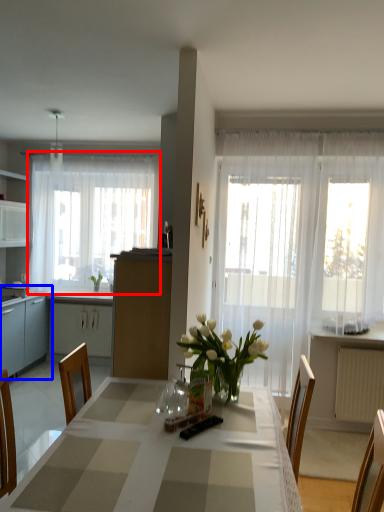
Question: Among these objects, which one is nearest to the camera, curtain (highlighted by a red box) or cabinetry (highlighted by a blue box)?

Choices:
 (A) curtain
 (B) cabinetry

Answer: (B)